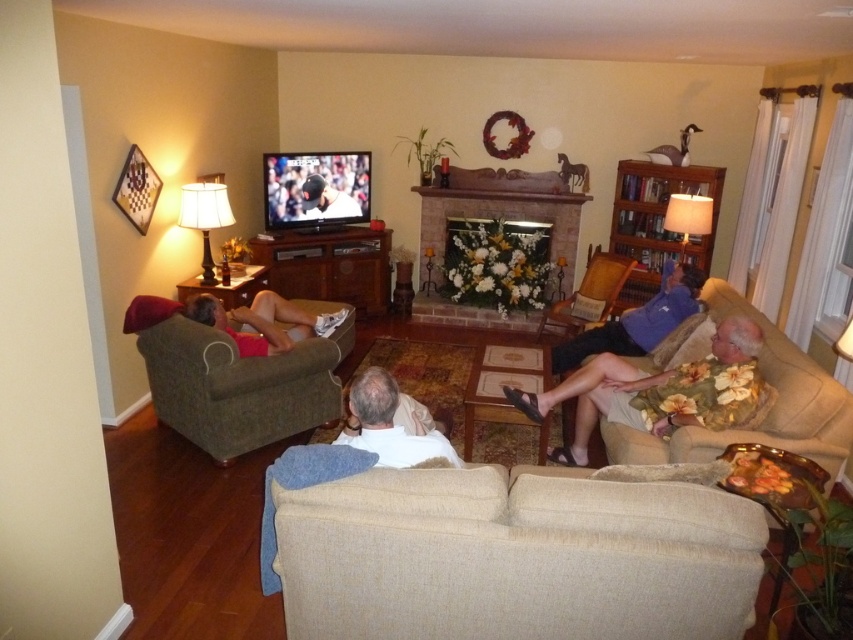
Question: Can you confirm if beige fabric couch at center is smaller than floral print dress at right?

Choices:
 (A) no
 (B) yes

Answer: (B)

Question: Which point is farther to the camera?

Choices:
 (A) (602, 307)
 (B) (553, 362)

Answer: (A)

Question: Among these points, which one is nearest to the camera?

Choices:
 (A) (328, 195)
 (B) (154, 397)
 (C) (589, 392)

Answer: (C)

Question: Is brown wooden armchair at center smaller than matte black shirt at center?

Choices:
 (A) no
 (B) yes

Answer: (A)

Question: From the image, what is the correct spatial relationship of green fabric armchair at left in relation to blue cotton shirt at right?

Choices:
 (A) above
 (B) below

Answer: (B)

Question: Which point appears closest to the camera in this image?

Choices:
 (A) (622, 349)
 (B) (558, 316)
 (C) (784, 385)
 (D) (721, 390)

Answer: (C)